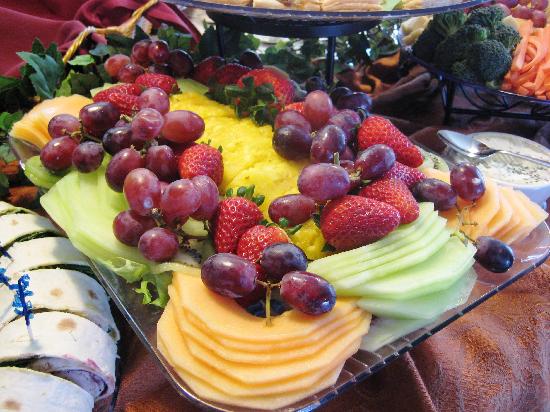
At what (x,y) coordinates should I click in order to perform the action: click on spoon. Please return your answer as a coordinate pair (x, y). Looking at the image, I should click on (477, 152).